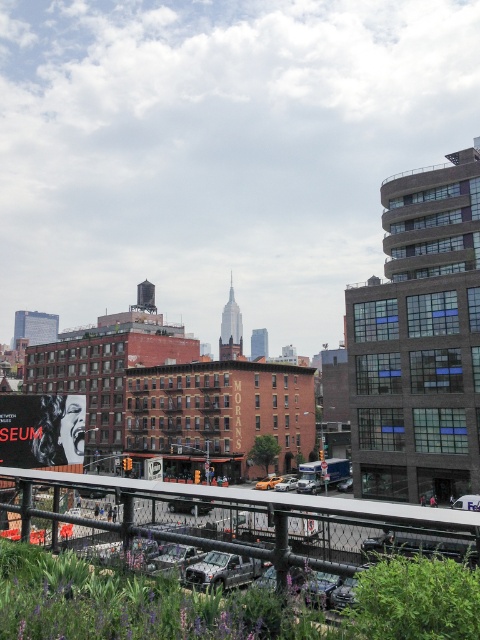
Question: Does black metal railing at lower center have a smaller size compared to matte black poster at lower left?

Choices:
 (A) no
 (B) yes

Answer: (A)

Question: Can you confirm if black metal railing at lower center is positioned to the left of matte black poster at lower left?

Choices:
 (A) yes
 (B) no

Answer: (B)

Question: Among these points, which one is farthest from the camera?

Choices:
 (A) (9, 448)
 (B) (383, 508)

Answer: (A)

Question: Is the position of black metal railing at lower center more distant than that of matte black poster at lower left?

Choices:
 (A) yes
 (B) no

Answer: (B)

Question: Which of the following is the closest to the observer?

Choices:
 (A) (60, 419)
 (B) (458, 516)

Answer: (B)